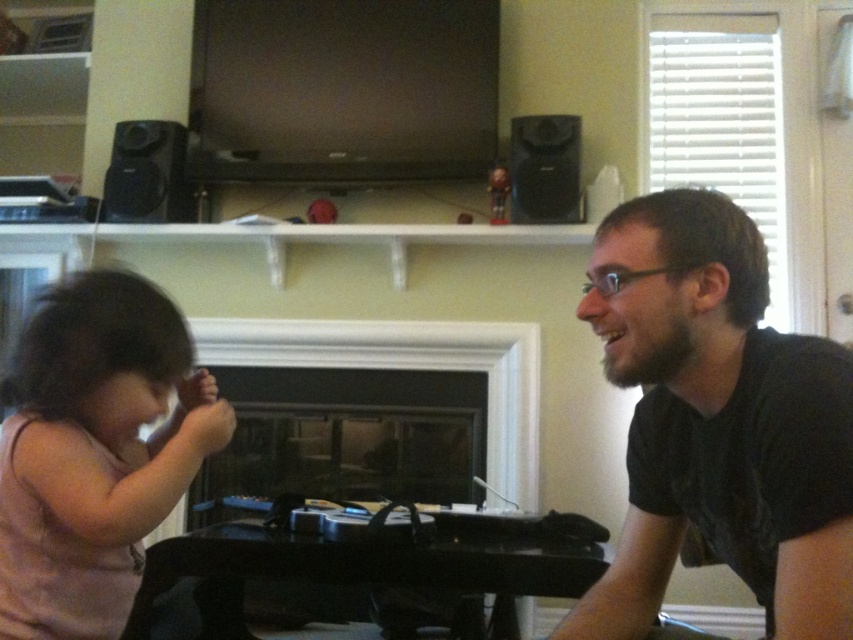
Question: Among these objects, which one is nearest to the camera?

Choices:
 (A) pink fabric at left
 (B) black matte shirt at right

Answer: (B)

Question: Does black matte shirt at right have a lesser width compared to pink fabric at left?

Choices:
 (A) no
 (B) yes

Answer: (A)

Question: Which object appears closest to the camera in this image?

Choices:
 (A) black matte shirt at right
 (B) pink fabric at left

Answer: (A)

Question: Which of the following is the farthest from the observer?

Choices:
 (A) black matte shirt at right
 (B) pink fabric at left

Answer: (B)

Question: Is black matte shirt at right below pink fabric at left?

Choices:
 (A) yes
 (B) no

Answer: (A)

Question: Where is black matte shirt at right located in relation to pink fabric at left in the image?

Choices:
 (A) below
 (B) above

Answer: (A)